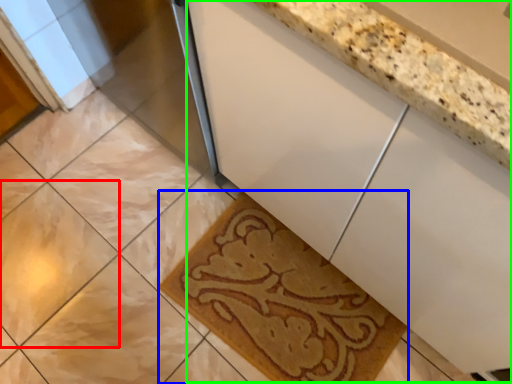
Question: Which is nearer to the ceramic tile (highlighted by a red box)? bath mat (highlighted by a blue box) or counter (highlighted by a green box).

Choices:
 (A) bath mat
 (B) counter

Answer: (A)